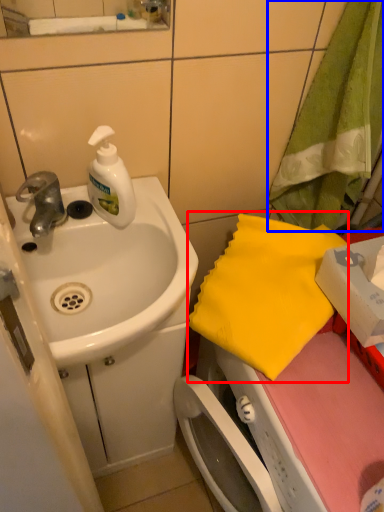
Question: Among these objects, which one is farthest to the camera, beach towel (highlighted by a red box) or beach towel (highlighted by a blue box)?

Choices:
 (A) beach towel
 (B) beach towel

Answer: (A)